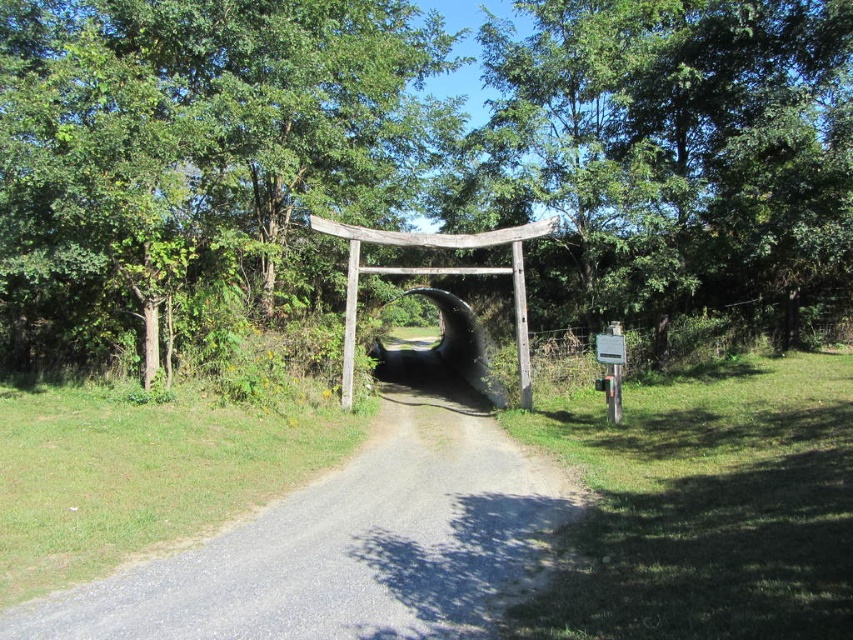
Which is more to the right, green wood tree at center or green leafy tree at center?

Positioned to the right is green leafy tree at center.

In the scene shown: Does green wood tree at center appear on the right side of green leafy tree at center?

No, green wood tree at center is not to the right of green leafy tree at center.

Which is behind, point (106, 237) or point (613, 51)?

Positioned behind is point (613, 51).

This screenshot has width=853, height=640. In order to click on green wood tree at center in this screenshot , I will do `click(418, 148)`.

Measure the distance between green wood tree at center and camera.

green wood tree at center and camera are 11.30 meters apart from each other.

Is green wood tree at center smaller than gray gravel path at center?

No, green wood tree at center is not smaller than gray gravel path at center.

Is point (163, 58) closer to viewer compared to point (399, 429)?

Yes, it is.

Find the location of `green wood tree at center`. green wood tree at center is located at coordinates (418, 148).

Who is positioned more to the right, green leafy tree at center or gray gravel path at center?

green leafy tree at center

Is green leafy tree at center wider than gray gravel path at center?

Correct, the width of green leafy tree at center exceeds that of gray gravel path at center.

Describe the element at coordinates (674, 147) in the screenshot. I see `green leafy tree at center` at that location.

The image size is (853, 640). I want to click on green leafy tree at center, so click(x=674, y=147).